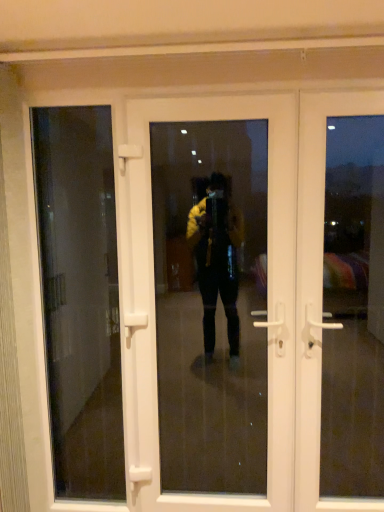
Locate an element on the screen. Image resolution: width=384 pixels, height=512 pixels. transparent glass door at left is located at coordinates (80, 298).

This screenshot has width=384, height=512. What do you see at coordinates (268, 290) in the screenshot?
I see `white plastic door at center, the 1th door in the left-to-right sequence` at bounding box center [268, 290].

This screenshot has height=512, width=384. What do you see at coordinates (316, 285) in the screenshot? I see `white plastic door at right, which is the second door from left to right` at bounding box center [316, 285].

Where is `transparent glass door at left`? The image size is (384, 512). transparent glass door at left is located at coordinates (80, 298).

How distant is transparent glass door at left from white plastic door at right, the first door when ordered from right to left?

transparent glass door at left and white plastic door at right, the first door when ordered from right to left, are 1.57 meters apart from each other.

Does point (82, 460) come farther from viewer compared to point (318, 482)?

Yes, it is behind point (318, 482).

From the image's perspective, is transparent glass door at left over white plastic door at right, the first door when ordered from right to left?

No, from the image's perspective, transparent glass door at left is not on top of white plastic door at right, the first door when ordered from right to left.

In the image, is transparent glass door at left positioned in front of or behind white plastic door at right, the first door when ordered from right to left?

transparent glass door at left is positioned farther from the viewer than white plastic door at right, the first door when ordered from right to left.

Considering the positions of objects transparent glass door at left and white plastic door at center, the 2th door positioned from the right, in the image provided, who is more to the left, transparent glass door at left or white plastic door at center, the 2th door positioned from the right,?

Positioned to the left is transparent glass door at left.

How different are the orientations of transparent glass door at left and white plastic door at center, the 1th door in the left-to-right sequence, in degrees?

The angular difference between transparent glass door at left and white plastic door at center, the 1th door in the left-to-right sequence, is 0.0059 degrees.

Does point (65, 205) appear closer or farther from the camera than point (281, 311)?

Clearly, point (65, 205) is more distant from the camera than point (281, 311).

Can we say transparent glass door at left lies outside white plastic door at center, the 1th door in the left-to-right sequence?

Yes.

Is white plastic door at center, the 1th door in the left-to-right sequence, closer to camera compared to transparent glass door at left?

Yes.

Consider the image. Considering the relative sizes of white plastic door at center, the 2th door positioned from the right, and transparent glass door at left in the image provided, is white plastic door at center, the 2th door positioned from the right, wider than transparent glass door at left?

Correct, the width of white plastic door at center, the 2th door positioned from the right, exceeds that of transparent glass door at left.

From a real-world perspective, who is located lower, white plastic door at center, the 1th door in the left-to-right sequence, or transparent glass door at left?

transparent glass door at left.

How much distance is there between white plastic door at center, the 1th door in the left-to-right sequence, and transparent glass door at left?

white plastic door at center, the 1th door in the left-to-right sequence, is 1.03 meters away from transparent glass door at left.

Is the depth of white plastic door at right, which is the second door from left to right, less than that of white plastic door at center, the 2th door positioned from the right?

Yes.

Looking at this image, does white plastic door at right, the first door when ordered from right to left, have a lesser height compared to white plastic door at center, the 2th door positioned from the right?

Yes, white plastic door at right, the first door when ordered from right to left, is shorter than white plastic door at center, the 2th door positioned from the right.

Considering the positions of objects white plastic door at right, the first door when ordered from right to left, and white plastic door at center, the 1th door in the left-to-right sequence, in the image provided, who is more to the right, white plastic door at right, the first door when ordered from right to left, or white plastic door at center, the 1th door in the left-to-right sequence,?

white plastic door at right, the first door when ordered from right to left.

In terms of size, does white plastic door at center, the 2th door positioned from the right, appear bigger or smaller than white plastic door at right, the first door when ordered from right to left?

Clearly, white plastic door at center, the 2th door positioned from the right, is larger in size than white plastic door at right, the first door when ordered from right to left.

Does point (183, 119) lie in front of point (309, 157)?

That is False.

Identify the location of door behind the white plastic door at right, the first door when ordered from right to left. Image resolution: width=384 pixels, height=512 pixels. (268, 290).

Considering the sizes of white plastic door at center, the 1th door in the left-to-right sequence, and white plastic door at right, the first door when ordered from right to left, in the image, is white plastic door at center, the 1th door in the left-to-right sequence, wider or thinner than white plastic door at right, the first door when ordered from right to left,?

Clearly, white plastic door at center, the 1th door in the left-to-right sequence, has more width compared to white plastic door at right, the first door when ordered from right to left.

Is white plastic door at right, the first door when ordered from right to left, beside transparent glass door at left?

No, white plastic door at right, the first door when ordered from right to left, is not beside transparent glass door at left.

Does white plastic door at right, the first door when ordered from right to left, lie in front of transparent glass door at left?

Yes, it is in front of transparent glass door at left.

Considering the sizes of objects white plastic door at right, which is the second door from left to right, and transparent glass door at left in the image provided, who is smaller, white plastic door at right, which is the second door from left to right, or transparent glass door at left?

transparent glass door at left.

Is transparent glass door at left inside white plastic door at right, the first door when ordered from right to left?

No, white plastic door at right, the first door when ordered from right to left, does not contain transparent glass door at left.

This screenshot has width=384, height=512. I want to click on window screen located underneath the white plastic door at right, which is the second door from left to right (from a real-world perspective), so click(x=80, y=298).

The width and height of the screenshot is (384, 512). I want to click on window screen that is below the white plastic door at center, the 1th door in the left-to-right sequence (from the image's perspective), so click(x=80, y=298).

Which object lies nearer to the anchor point white plastic door at center, the 1th door in the left-to-right sequence, white plastic door at right, which is the second door from left to right, or transparent glass door at left?

white plastic door at right, which is the second door from left to right, lies closer to white plastic door at center, the 1th door in the left-to-right sequence, than the other object.

Based on their spatial positions, is white plastic door at center, the 2th door positioned from the right, or transparent glass door at left further from white plastic door at right, which is the second door from left to right?

transparent glass door at left lies further to white plastic door at right, which is the second door from left to right, than the other object.

From the picture: Considering their positions, is transparent glass door at left positioned further to white plastic door at center, the 1th door in the left-to-right sequence, than white plastic door at right, the first door when ordered from right to left?

Based on the image, transparent glass door at left appears to be further to white plastic door at center, the 1th door in the left-to-right sequence.

Looking at the image, which one is located further to transparent glass door at left, white plastic door at center, the 1th door in the left-to-right sequence, or white plastic door at right, which is the second door from left to right?

Based on the image, white plastic door at right, which is the second door from left to right, appears to be further to transparent glass door at left.

Estimate the real-world distances between objects in this image. Which object is further from white plastic door at right, which is the second door from left to right, transparent glass door at left or white plastic door at center, the 2th door positioned from the right?

transparent glass door at left lies further to white plastic door at right, which is the second door from left to right, than the other object.

From the image, which object appears to be farther from transparent glass door at left, white plastic door at right, which is the second door from left to right, or white plastic door at center, the 2th door positioned from the right?

The object further to transparent glass door at left is white plastic door at right, which is the second door from left to right.

Locate an element on the screen. The height and width of the screenshot is (512, 384). door located between transparent glass door at left and white plastic door at right, which is the second door from left to right, in the left-right direction is located at coordinates click(x=268, y=290).